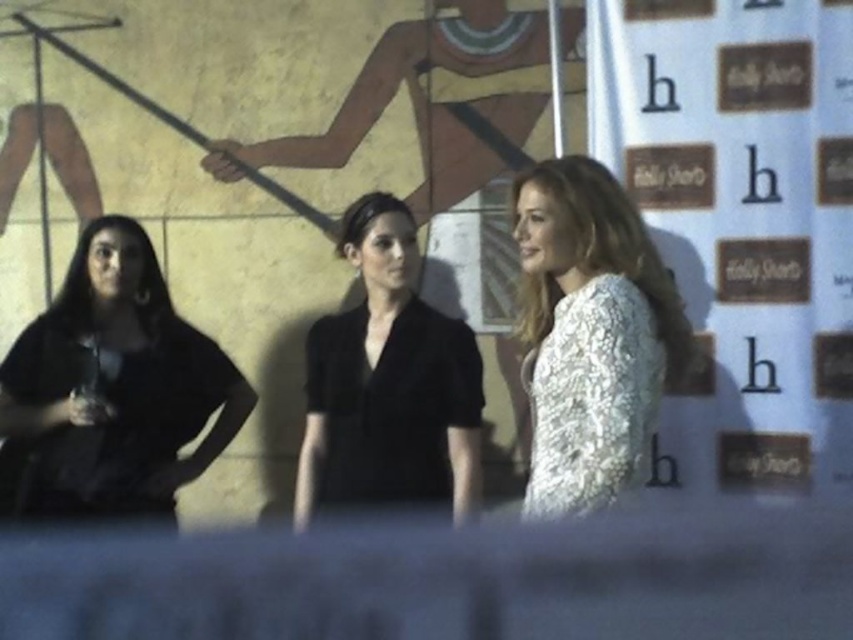
You are attending the Holly Shorts event and need to take a photo of the black matte blazer at center and the white lace dress at right. Based on their positions, which one is higher up in the frame?

The black matte blazer at center is above the white lace dress at right, so it is higher up in the frame.

You are standing at the origin point of the image coordinate system. The black matte blazer at center is located at point [387,384]. If you want to move towards the black matte blazer at center, which direction should you move in terms of x and y coordinates?

To move towards the black matte blazer at center located at point [387,384] from the origin, you should move in the positive x and positive y direction since both coordinates are greater than zero.